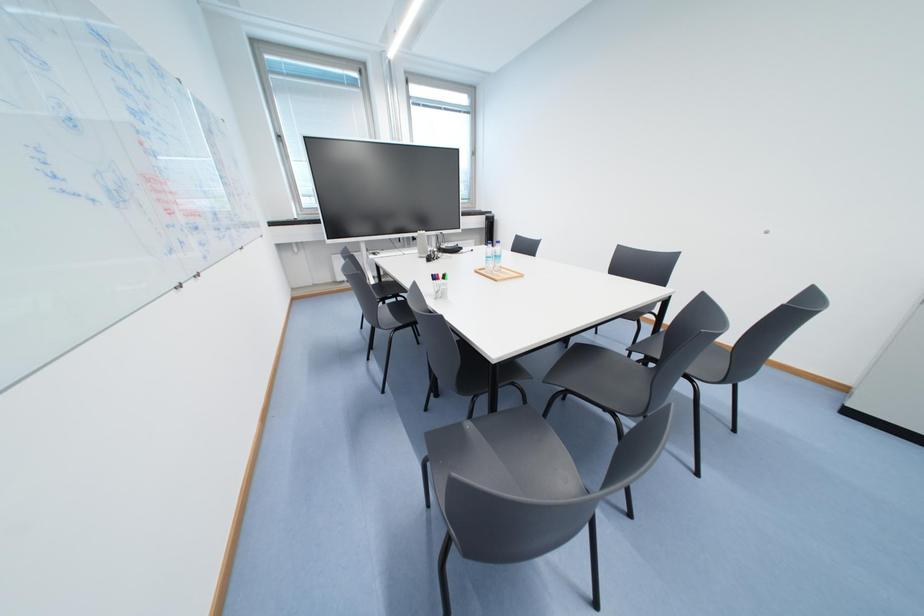
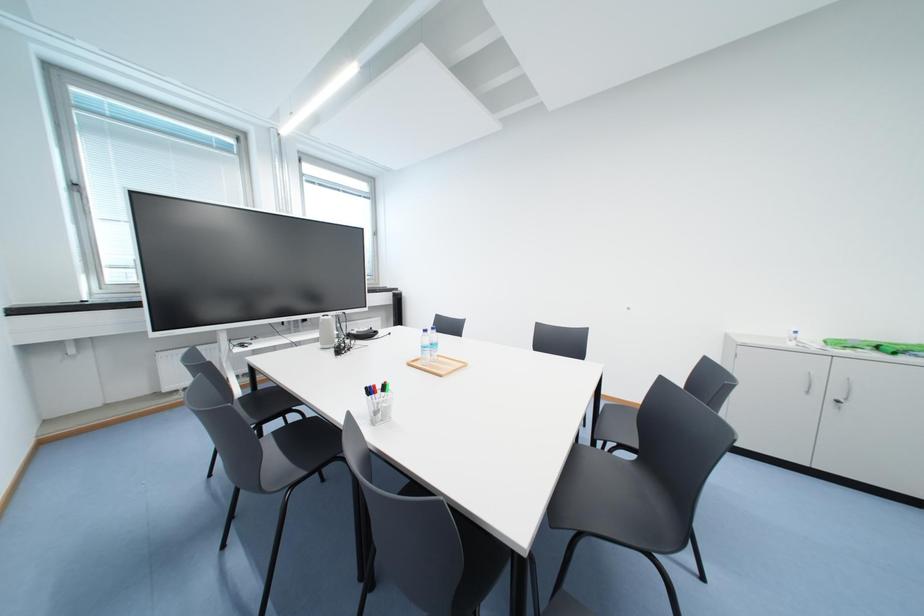
Question: The first image is from the beginning of the video and the second image is from the end. How did the camera likely rotate when shooting the video?

Choices:
 (A) Left
 (B) Right
 (C) Up
 (D) Down

Answer: (B)